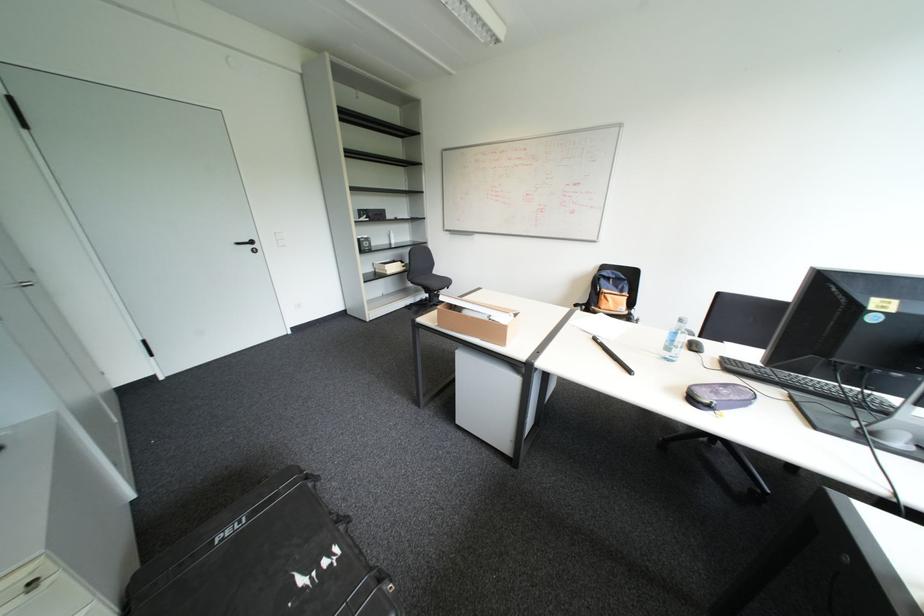
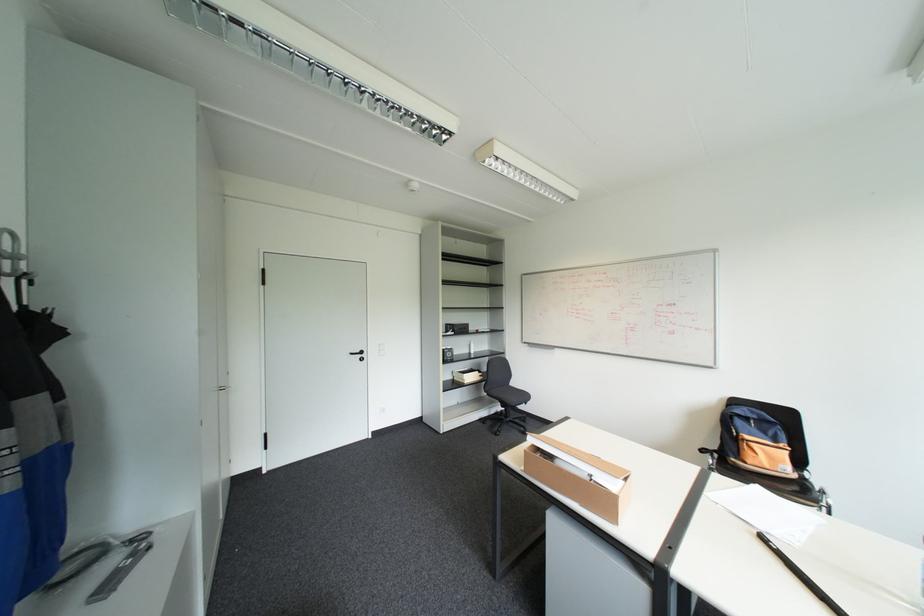
Where in the second image is the point corresponding to (638,302) from the first image?

(808, 460)